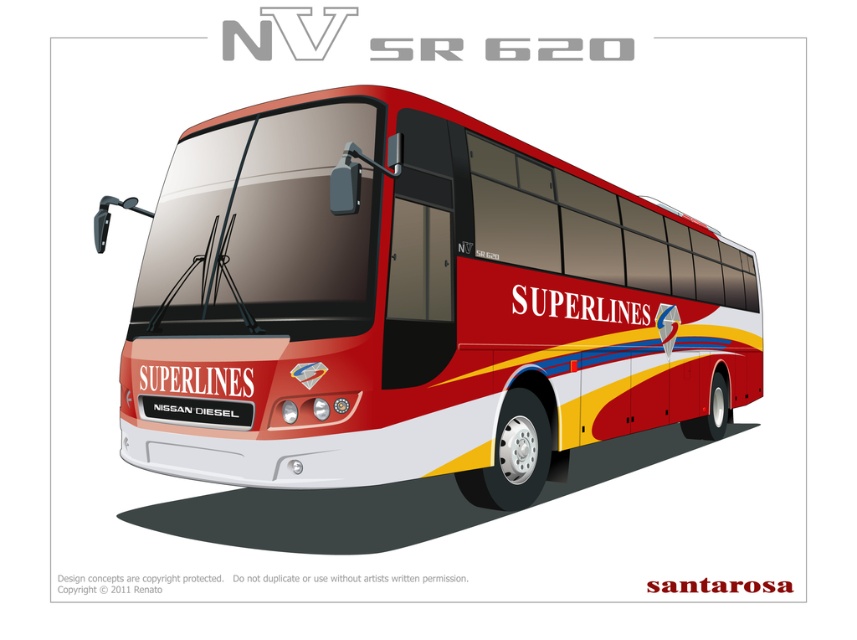
Question: Can you confirm if shiny red bus at center is bigger than matte black license plate at front?

Choices:
 (A) no
 (B) yes

Answer: (A)

Question: Which point appears farthest from the camera in this image?

Choices:
 (A) (207, 426)
 (B) (759, 321)

Answer: (B)

Question: Which of the following is the closest to the observer?

Choices:
 (A) pyautogui.click(x=168, y=419)
 (B) pyautogui.click(x=276, y=280)

Answer: (B)

Question: In this image, where is shiny red bus at center located relative to matte black license plate at front?

Choices:
 (A) left
 (B) right

Answer: (B)

Question: Observing the image, what is the correct spatial positioning of shiny red bus at center in reference to matte black license plate at front?

Choices:
 (A) right
 (B) left

Answer: (A)